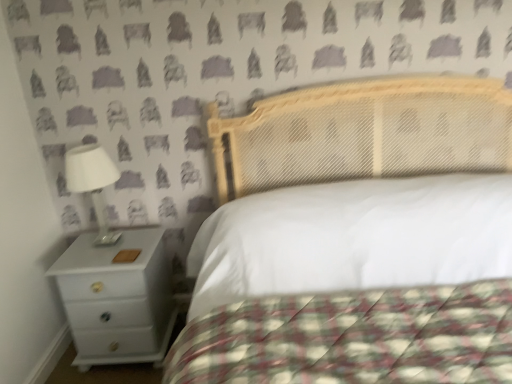
Question: Considering the relative positions of white glossy nightstand at lower left and white glossy lamp at left in the image provided, is white glossy nightstand at lower left to the left of white glossy lamp at left from the viewer's perspective?

Choices:
 (A) yes
 (B) no

Answer: (B)

Question: Is white glossy nightstand at lower left not within white glossy lamp at left?

Choices:
 (A) yes
 (B) no

Answer: (A)

Question: Can white glossy lamp at left be found inside white glossy nightstand at lower left?

Choices:
 (A) no
 (B) yes

Answer: (A)

Question: Considering the relative sizes of white glossy nightstand at lower left and white glossy lamp at left in the image provided, is white glossy nightstand at lower left thinner than white glossy lamp at left?

Choices:
 (A) no
 (B) yes

Answer: (A)

Question: Can you confirm if white glossy nightstand at lower left is shorter than white glossy lamp at left?

Choices:
 (A) no
 (B) yes

Answer: (A)

Question: Can you confirm if white glossy nightstand at lower left is taller than white glossy lamp at left?

Choices:
 (A) no
 (B) yes

Answer: (B)

Question: Is white glossy nightstand at lower left a part of white glossy lamp at left?

Choices:
 (A) no
 (B) yes

Answer: (A)

Question: From the image's perspective, is white glossy lamp at left located beneath white glossy nightstand at lower left?

Choices:
 (A) no
 (B) yes

Answer: (A)

Question: Could you tell me if white glossy lamp at left is turned towards white glossy nightstand at lower left?

Choices:
 (A) no
 (B) yes

Answer: (A)

Question: Is white glossy lamp at left to the right of white glossy nightstand at lower left from the viewer's perspective?

Choices:
 (A) yes
 (B) no

Answer: (B)

Question: From a real-world perspective, is white glossy lamp at left below white glossy nightstand at lower left?

Choices:
 (A) yes
 (B) no

Answer: (B)

Question: Is white glossy lamp at left positioned in front of white glossy nightstand at lower left?

Choices:
 (A) yes
 (B) no

Answer: (A)

Question: From the image's perspective, does white glossy nightstand at lower left appear lower than white quilted fabric at center?

Choices:
 (A) no
 (B) yes

Answer: (B)